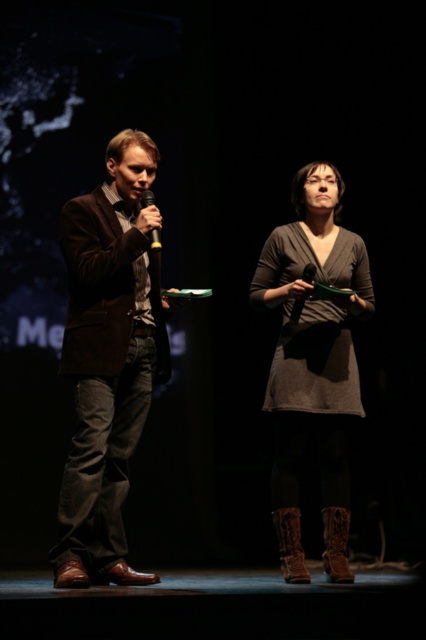
Which of these two, matte gray dress at center or brown suede boot at lower center, stands shorter?

brown suede boot at lower center is shorter.

Is matte gray dress at center taller than brown suede boot at lower center?

Correct, matte gray dress at center is much taller as brown suede boot at lower center.

Locate an element on the screen. This screenshot has height=640, width=426. matte gray dress at center is located at coordinates (311, 349).

Does matte brown suit at left appear on the left side of brown suede boot at lower center?

Indeed, matte brown suit at left is positioned on the left side of brown suede boot at lower center.

Which is above, matte brown suit at left or brown suede boot at lower center?

matte brown suit at left is higher up.

Locate an element on the screen. This screenshot has width=426, height=640. matte brown suit at left is located at coordinates (109, 358).

This screenshot has width=426, height=640. Identify the location of matte brown suit at left. (109, 358).

From the picture: Who is positioned more to the left, matte gray dress at center or brown leather boot at lower right?

matte gray dress at center

Does matte gray dress at center have a greater width compared to brown leather boot at lower right?

Yes.

Is point (322, 225) closer to camera compared to point (322, 515)?

Yes, point (322, 225) is closer to viewer.

This screenshot has width=426, height=640. Identify the location of matte gray dress at center. (311, 349).